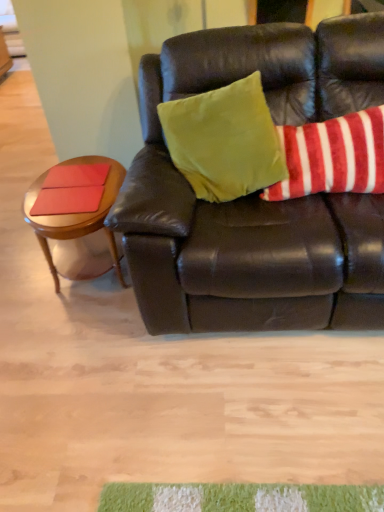
Identify the location of empty space that is ontop of matte red pad at left, marked as the 1th pad in a bottom-to-top arrangement (from a real-world perspective). This screenshot has height=512, width=384. (66, 198).